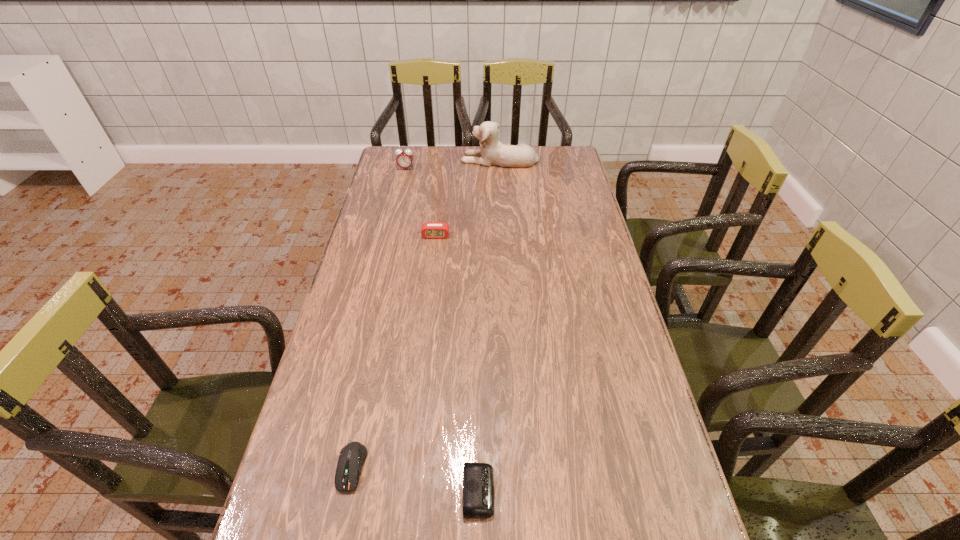
Where is `object present at the far left corner`? The height and width of the screenshot is (540, 960). object present at the far left corner is located at coordinates (404, 159).

Locate an element on the screen. object that is positioned at the far right corner is located at coordinates (493, 152).

In the image, there is a desktop. Where is `vacant space at the far edge`? vacant space at the far edge is located at coordinates (463, 156).

Where is `free spot at the left edge of the desktop`? The height and width of the screenshot is (540, 960). free spot at the left edge of the desktop is located at coordinates (330, 382).

Locate an element on the screen. The image size is (960, 540). free location at the right edge of the desktop is located at coordinates (643, 517).

At what (x,y) coordinates should I click in order to perform the action: click on vacant space in between the computer equipment and the tallest object. Please return your answer as a coordinate pair (x, y). Image resolution: width=960 pixels, height=540 pixels. Looking at the image, I should click on (425, 313).

The image size is (960, 540). Identify the location of free spot between the nearest alarm clock and the second tallest alarm clock. (457, 363).

Identify the location of vacant space in between the puppy and the second alarm clock from left to right. The image size is (960, 540). (468, 198).

Identify the location of free area in between the fourth shortest object and the second shortest object. The image size is (960, 540). (378, 318).

Locate an element on the screen. This screenshot has height=540, width=960. vacant region between the second tallest object and the second shortest object is located at coordinates (378, 318).